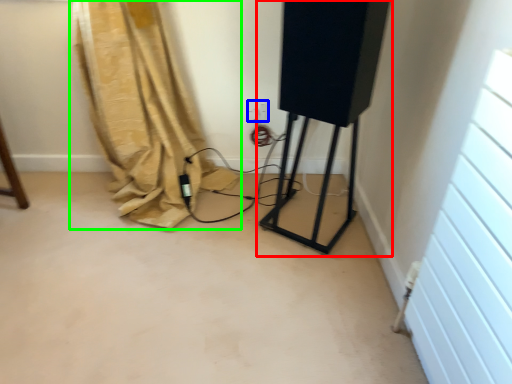
Question: Which object is the farthest from equipment (highlighted by a red box)? Choose among these: electric outlet (highlighted by a blue box) or curtain (highlighted by a green box).

Choices:
 (A) electric outlet
 (B) curtain

Answer: (B)